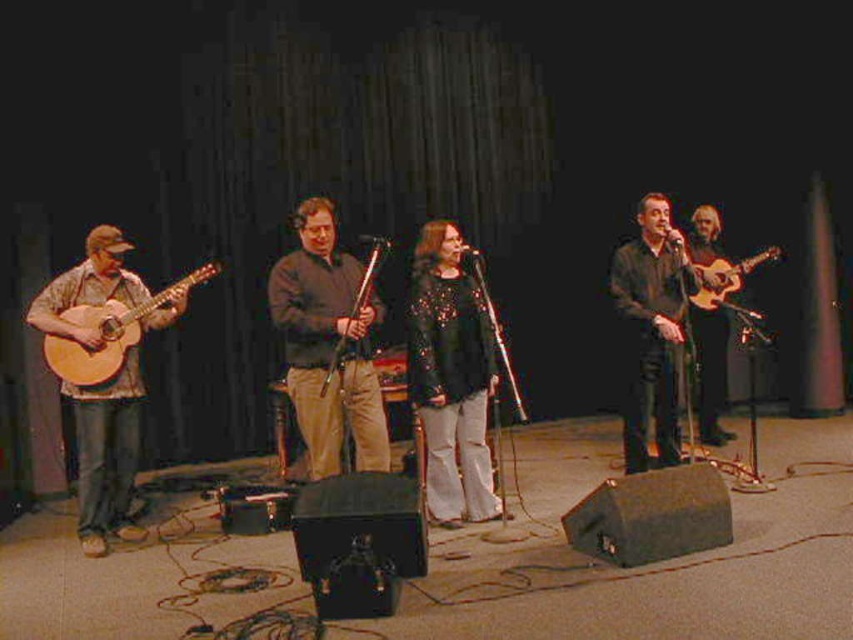
Question: Is matte brown guitar at left positioned in front of natural wood acoustic guitar at left?

Choices:
 (A) yes
 (B) no

Answer: (A)

Question: Does sparkly black dress at center have a smaller size compared to light brown acoustic guitar at right?

Choices:
 (A) no
 (B) yes

Answer: (A)

Question: Is matte brown acoustic guitar at left bigger than matte black shirt at center?

Choices:
 (A) yes
 (B) no

Answer: (A)

Question: Which object is the farthest from the matte brown acoustic guitar at center?

Choices:
 (A) matte brown acoustic guitar at left
 (B) natural wood acoustic guitar at left
 (C) light brown acoustic guitar at right
 (D) sparkly black dress at center

Answer: (C)

Question: Which point is closer to the camera?

Choices:
 (A) light brown acoustic guitar at right
 (B) sparkly black dress at center
 (C) matte brown guitar at left
 (D) matte brown acoustic guitar at left

Answer: (C)

Question: Which is farther from the matte black shirt at center?

Choices:
 (A) matte brown acoustic guitar at center
 (B) matte brown acoustic guitar at left

Answer: (B)